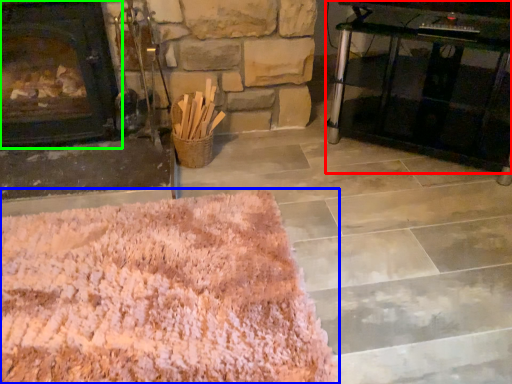
Question: Considering the real-world distances, which object is farthest from table (highlighted by a red box)? mat (highlighted by a blue box) or fireplace (highlighted by a green box)?

Choices:
 (A) mat
 (B) fireplace

Answer: (B)